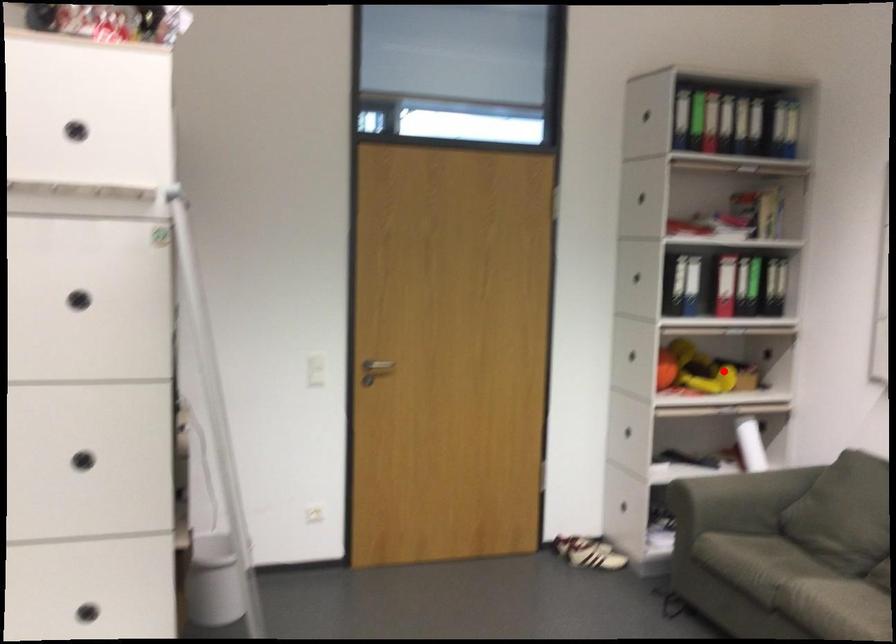
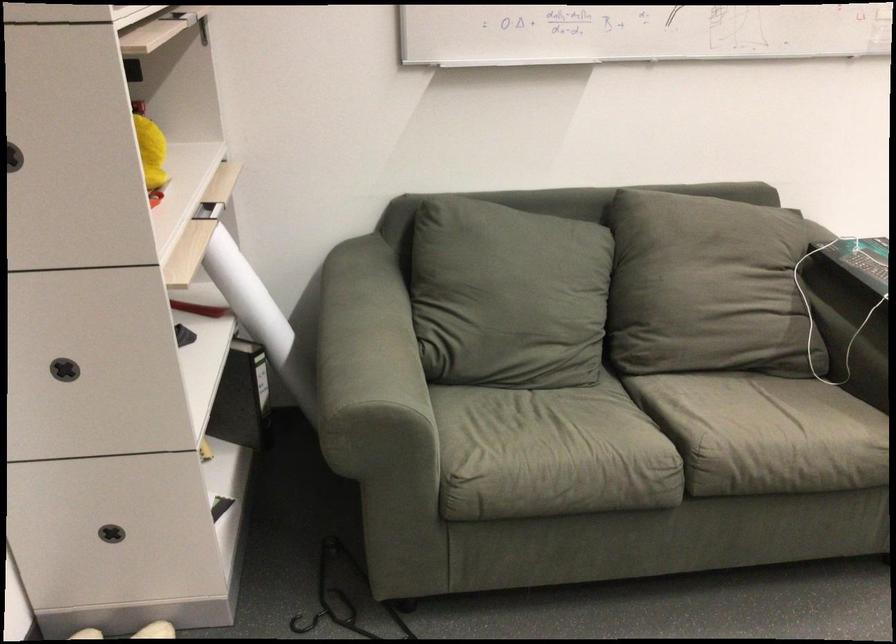
Question: I am providing you with two images of the same scene from different viewpoints. A red point is shown in image1. For the corresponding object point in image2, is it positioned nearer or farther from the camera?

Choices:
 (A) Nearer
 (B) Farther

Answer: (A)